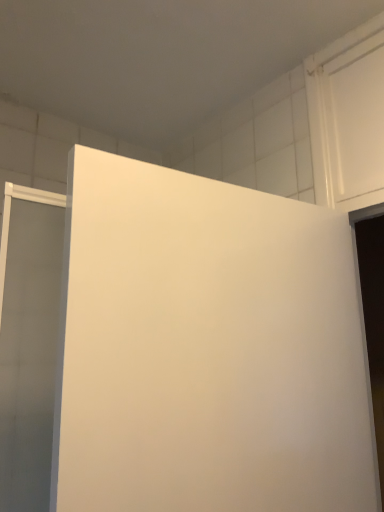
Locate an element on the screen. white matte board at center is located at coordinates (207, 348).

Image resolution: width=384 pixels, height=512 pixels. What do you see at coordinates (207, 348) in the screenshot?
I see `white matte board at center` at bounding box center [207, 348].

The height and width of the screenshot is (512, 384). Identify the location of white matte board at center. (207, 348).